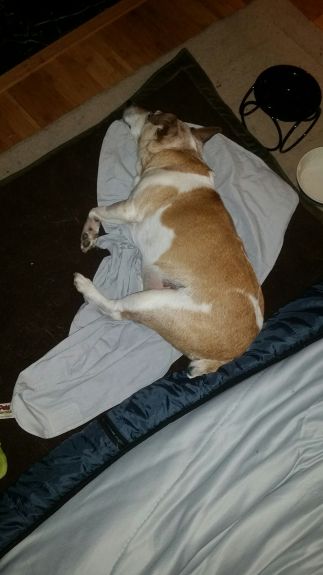
The width and height of the screenshot is (323, 575). In order to click on wooden floor in this screenshot , I will do `click(76, 68)`.